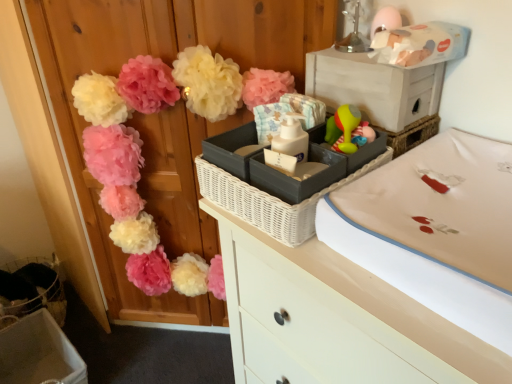
Question: Could you tell me if beige fabric changing pad at center-right is facing matte plastic storage box at lower left, the 2th storage box from the front?

Choices:
 (A) no
 (B) yes

Answer: (A)

Question: Does beige fabric changing pad at center-right have a lesser width compared to matte plastic storage box at lower left, placed as the second storage box when sorted from right to left?

Choices:
 (A) no
 (B) yes

Answer: (A)

Question: Does beige fabric changing pad at center-right appear on the right side of matte plastic storage box at lower left, placed as the second storage box when sorted from right to left?

Choices:
 (A) yes
 (B) no

Answer: (A)

Question: Considering the relative positions of beige fabric changing pad at center-right and matte plastic storage box at lower left, arranged as the second storage box when viewed from the top, in the image provided, is beige fabric changing pad at center-right to the left of matte plastic storage box at lower left, arranged as the second storage box when viewed from the top, from the viewer's perspective?

Choices:
 (A) yes
 (B) no

Answer: (B)

Question: Can you confirm if beige fabric changing pad at center-right is smaller than matte plastic storage box at lower left, placed as the second storage box when sorted from right to left?

Choices:
 (A) yes
 (B) no

Answer: (A)

Question: In terms of height, does matte gray storage box at upper right, acting as the 2th storage box starting from the back, look taller or shorter compared to white glossy chest of drawers at upper center?

Choices:
 (A) short
 (B) tall

Answer: (A)

Question: From a real-world perspective, relative to white glossy chest of drawers at upper center, is matte gray storage box at upper right, positioned as the 1th storage box in right-to-left order, vertically above or below?

Choices:
 (A) below
 (B) above

Answer: (B)

Question: Would you say matte gray storage box at upper right, which is counted as the first storage box, starting from the front, is to the left or to the right of white glossy chest of drawers at upper center in the picture?

Choices:
 (A) right
 (B) left

Answer: (B)

Question: Is matte gray storage box at upper right, the first storage box in the top-to-bottom sequence, bigger or smaller than white glossy chest of drawers at upper center?

Choices:
 (A) big
 (B) small

Answer: (B)

Question: Relative to matte pink pom-poms at upper left, is white glossy chest of drawers at upper center in front or behind?

Choices:
 (A) front
 (B) behind

Answer: (A)

Question: From a real-world perspective, relative to matte pink pom-poms at upper left, is white glossy chest of drawers at upper center vertically above or below?

Choices:
 (A) above
 (B) below

Answer: (B)

Question: Looking at the image, does white glossy chest of drawers at upper center seem bigger or smaller compared to matte pink pom-poms at upper left?

Choices:
 (A) big
 (B) small

Answer: (B)

Question: Is point (320, 264) closer or farther from the camera than point (253, 48)?

Choices:
 (A) farther
 (B) closer

Answer: (B)

Question: From a real-world perspective, is matte pink pom-poms at upper left physically located above or below matte gray storage box at upper right, which is the 2th storage box in bottom-to-top order?

Choices:
 (A) above
 (B) below

Answer: (B)

Question: Relative to matte gray storage box at upper right, which is counted as the first storage box, starting from the front, is matte pink pom-poms at upper left in front or behind?

Choices:
 (A) behind
 (B) front

Answer: (A)